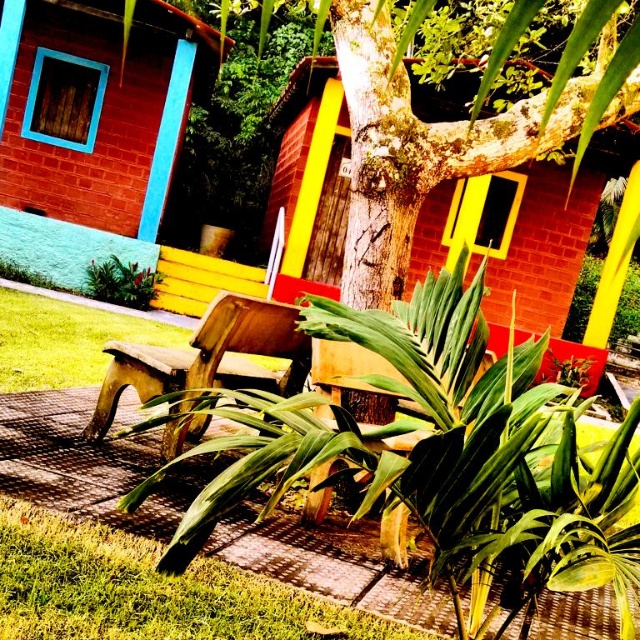
You are a visitor at the garden and want to take a photo of the brick textured hut at center and the wooden bench at center. Which object should you focus on first if you want to capture both in the frame without moving the camera?

The brick textured hut at center is shorter than the wooden bench at center, so you should focus on the wooden bench at center first to ensure both are in frame.

You are standing at the point with coordinates (209, 356) in the image. What object are you standing on?

The point at coordinates (209, 356) indicates the wooden bench at center.